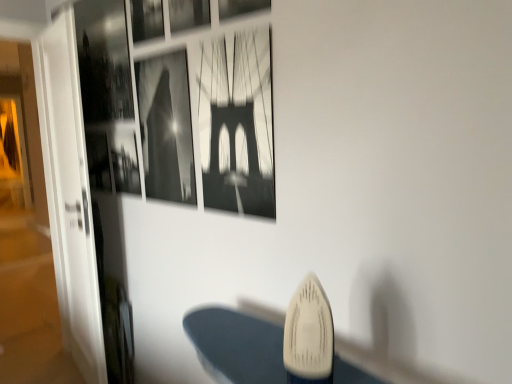
Question: Is black paper at center, marked as the fourth picture frame in a left-to-right arrangement, in front of or behind metallic silver picture frame at upper center, the 3th picture frame when ordered from right to left, in the image?

Choices:
 (A) front
 (B) behind

Answer: (A)

Question: From a real-world perspective, is black paper at center, the second picture frame in the right-to-left sequence, physically located above or below metallic silver picture frame at upper center, the 3th picture frame when ordered from right to left?

Choices:
 (A) above
 (B) below

Answer: (B)

Question: Which object is positioned closest to the black paper at center, the second picture frame in the right-to-left sequence?

Choices:
 (A) metallic silver picture frame at upper center, the 3th picture frame when ordered from right to left
 (B) white plastic iron at lower center
 (C) metallic silver picture frame at upper center, which appears as the 5th picture frame when viewed from the right
 (D) metallic silver picture frame at upper center, the 5th picture frame viewed from the left
 (E) black and white photograph at upper center, the second picture frame in the left-to-right sequence

Answer: (E)

Question: Estimate the real-world distances between objects in this image. Which object is farther from the metallic silver picture frame at upper center, the 5th picture frame viewed from the left?

Choices:
 (A) metallic silver picture frame at upper center, the 3th picture frame when ordered from right to left
 (B) black paper at center, the second picture frame in the right-to-left sequence
 (C) transparent glass door at left
 (D) metallic silver picture frame at upper center, the first picture frame positioned from the left
 (E) white plastic iron at lower center

Answer: (C)